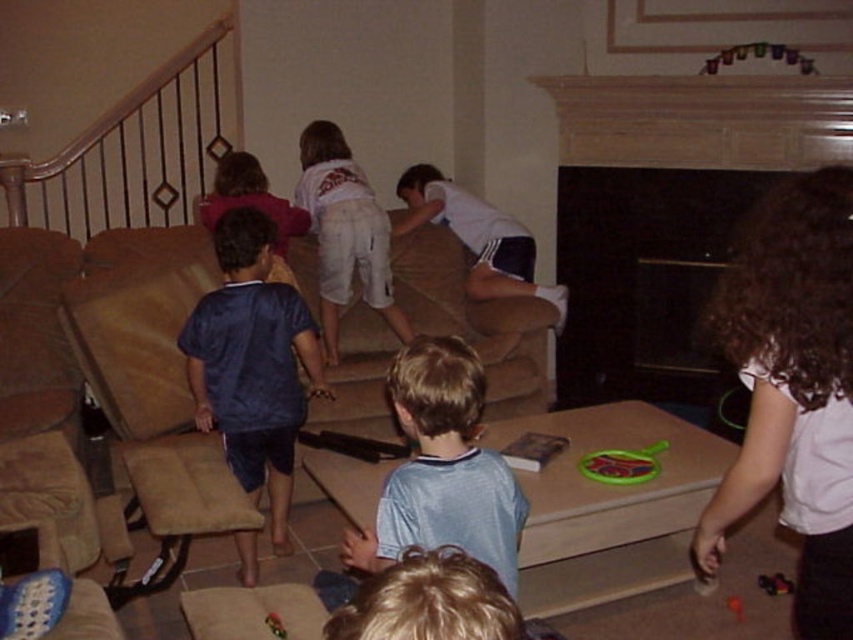
You are a parent who wants to retrieve the rubberized plastic toy at lower center from the living room. The black matte fireplace at center is in your way. Can you walk around it to reach the toy?

The distance between the black matte fireplace at center and the rubberized plastic toy at lower center is 2.07 meters. Since the fireplace is an obstacle, you can walk around it to reach the toy as the distance allows sufficient space for movement.

You are a parent trying to store the light blue jersey at center and the rubberized plastic toy at lower center in a drawer. The drawer has a width of 30 cm. Which item might not fit if placed horizontally?

The light blue jersey at center has a larger width than the rubberized plastic toy at lower center, so the light blue jersey at center might not fit in the 30 cm wide drawer if placed horizontally.

You are a parent trying to decide which item to pick up first between the white cotton shirt at center and the rubberized green frisbee at lower center. Since you want to pick the wider item first, which one should you choose?

The white cotton shirt at center is wider than the rubberized green frisbee at lower center, so you should pick up the white cotton shirt at center first.